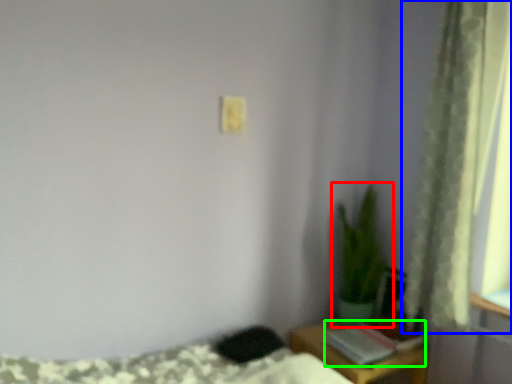
Question: Which object is positioned closest to houseplant (highlighted by a red box)? Select from curtain (highlighted by a blue box) and book (highlighted by a green box).

Choices:
 (A) curtain
 (B) book

Answer: (B)